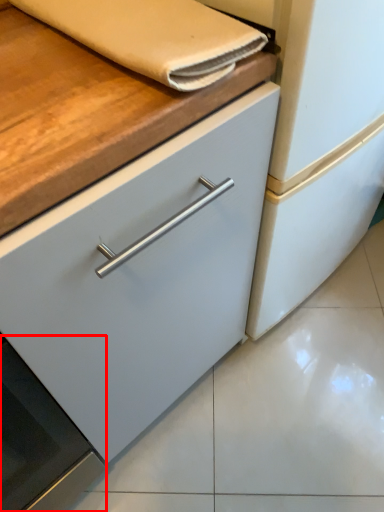
Question: Considering the relative positions of oven (annotated by the red box) and hand towel in the image provided, where is oven (annotated by the red box) located with respect to the staircase?

Choices:
 (A) left
 (B) right

Answer: (A)